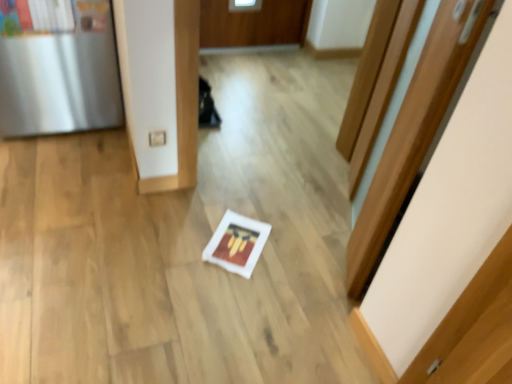
Find the location of `vacant region to the right of white matte frame at center`. vacant region to the right of white matte frame at center is located at coordinates (291, 274).